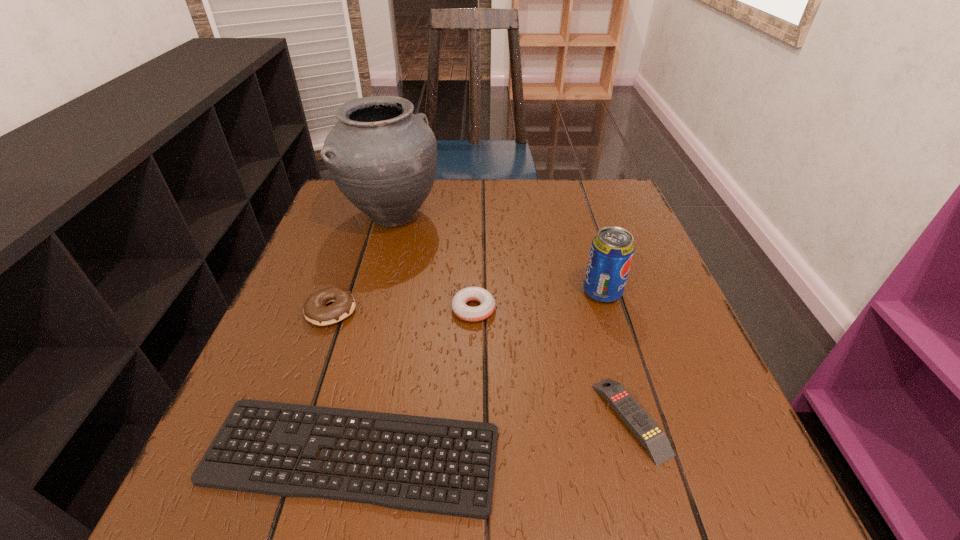
The height and width of the screenshot is (540, 960). Identify the location of free area in between the computer keyboard and the left doughnut. (342, 383).

Image resolution: width=960 pixels, height=540 pixels. What are the coordinates of `vacant region between the farthest object and the computer keyboard` in the screenshot? It's located at (372, 336).

Locate which object is the fifth closest to the fifth shortest object. Please provide its 2D coordinates. Your answer should be formatted as a tuple, i.e. [(x, y)], where the tuple contains the x and y coordinates of a point satisfying the conditions above.

[(315, 310)]

Identify which object is the fifth closest to the shortest object. Please provide its 2D coordinates. Your answer should be formatted as a tuple, i.e. [(x, y)], where the tuple contains the x and y coordinates of a point satisfying the conditions above.

[(383, 158)]

You are a GUI agent. You are given a task and a screenshot of the screen. Output one action in this format:
    pyautogui.click(x=<x>, y=<y>)
    Task: Click on the vacant region that satisfies the following two spatial constraints: 1. on the front side of the farthest object; 2. on the left side of the second tallest object
    Image resolution: width=960 pixels, height=540 pixels.
    Given the screenshot: What is the action you would take?
    pyautogui.click(x=372, y=292)